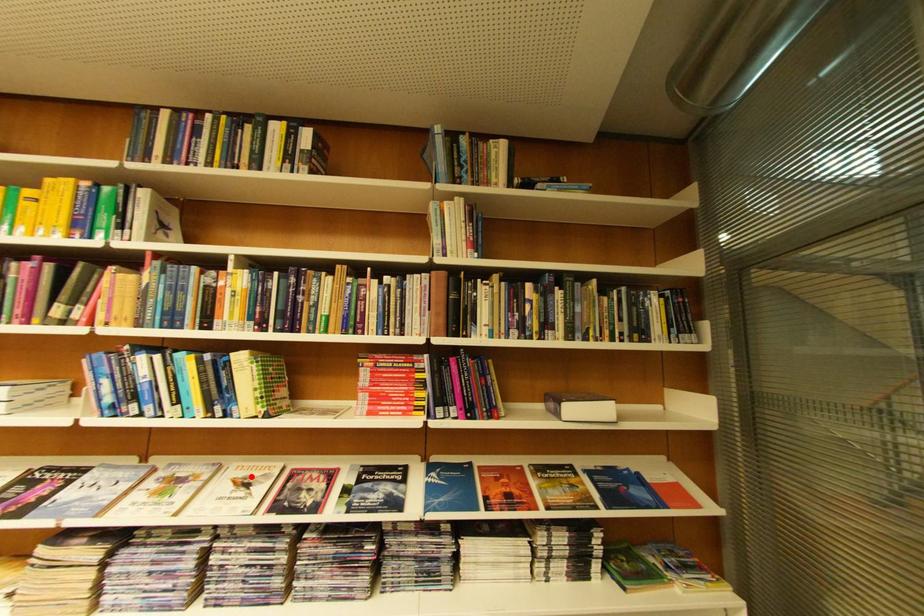
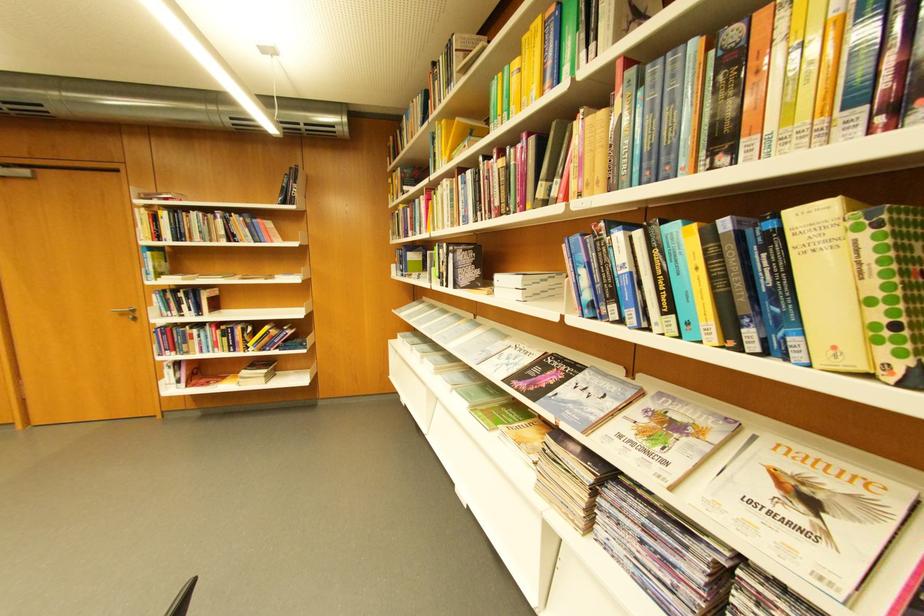
Locate, in the second image, the point that corresponds to the highlighted location in the first image.

(800, 469)